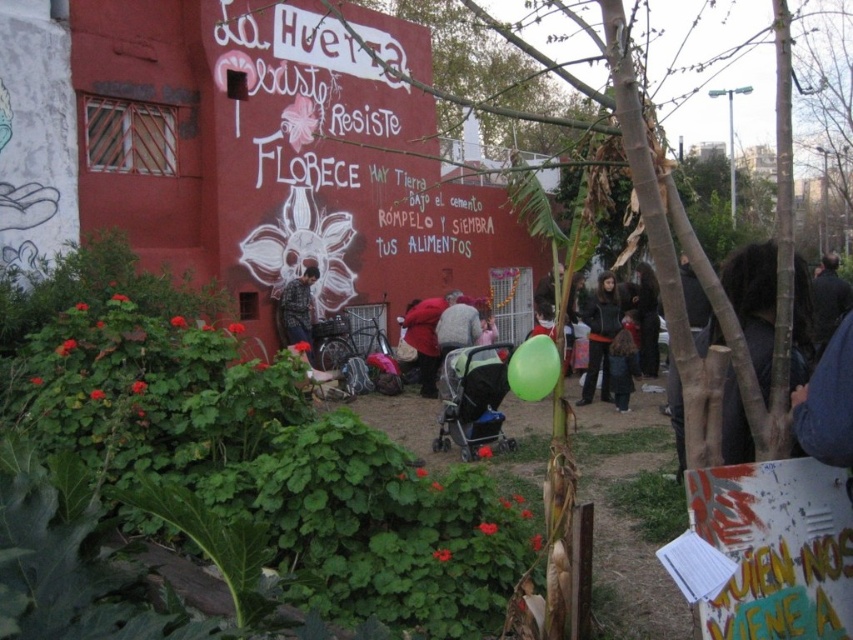
You are a parent visiting the garden area in front of the red building with bold white graffiti. You see a black fabric stroller at center and a red matte jacket at center. Which object is positioned to the right of the other?

The black fabric stroller at center is to the right of the red matte jacket at center.

You are a photographer taking a picture of the vibrant red building with bold white graffiti art. You notice two people wearing a dark gray sweater at center and a red matte jacket at center. Which person is positioned to the right side of the other?

The dark gray sweater at center is to the right of the red matte jacket at center.

You are a delivery person trying to navigate through the area in front of the red building with bold white graffiti art. You need to pass between the black fabric stroller at center and the green rubber balloon at center. Can you fit through the space between them?

The black fabric stroller at center might be wider than green rubber balloon at center, so there is a possibility that the space between them is narrow. It is recommended to check the actual width before attempting to pass through to ensure safety.